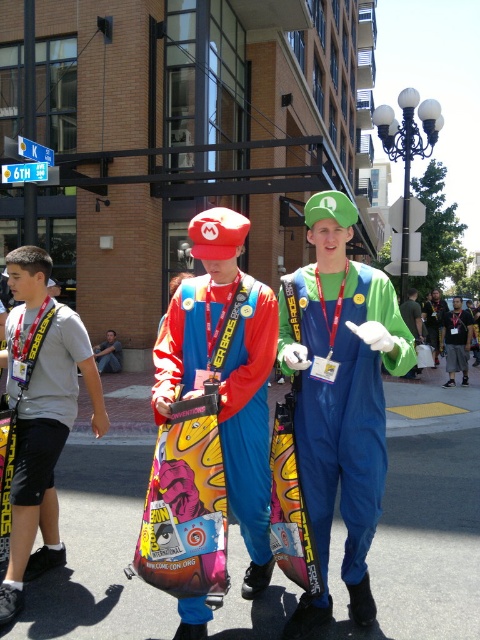
Who is lower down, green matte luigi costume at center or matte plastic bag at center?

Positioned lower is matte plastic bag at center.

Who is more distant from viewer, (396, 353) or (257, 579)?

Point (257, 579)

Which is behind, point (364, 392) or point (269, 324)?

The point (269, 324) is more distant.

At what (x,y) coordinates should I click in order to perform the action: click on green matte luigi costume at center. Please return your answer as a coordinate pair (x, y). The image size is (480, 640). Looking at the image, I should click on coord(339,397).